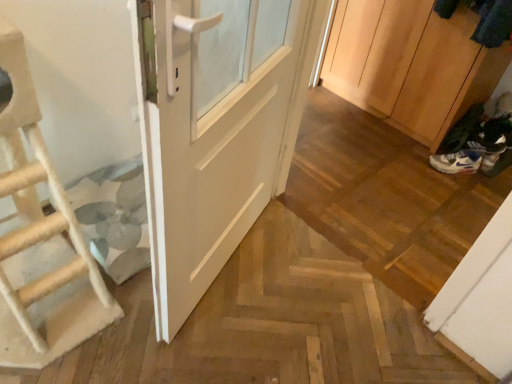
Where is `white leather shoe at lower right`? white leather shoe at lower right is located at coordinates (484, 154).

Find the location of `white mesh shoe at lower right`. white mesh shoe at lower right is located at coordinates (456, 162).

I want to click on white matte door at center, so click(215, 130).

This screenshot has height=384, width=512. What do you see at coordinates (215, 130) in the screenshot?
I see `white matte door at center` at bounding box center [215, 130].

Locate an element on the screen. This screenshot has width=512, height=384. white leather shoe at lower right is located at coordinates (484, 154).

In the scene shown: Could you tell me if white leather shoe at lower right is facing beige rope ladder at left?

No, white leather shoe at lower right is not facing towards beige rope ladder at left.

Is beige rope ladder at left a part of white leather shoe at lower right?

Actually, beige rope ladder at left is outside white leather shoe at lower right.

From a real-world perspective, is white leather shoe at lower right positioned above or below beige rope ladder at left?

From a real-world perspective, white leather shoe at lower right is physically below beige rope ladder at left.

Can you confirm if white leather shoe at lower right is wider than beige rope ladder at left?

In fact, white leather shoe at lower right might be narrower than beige rope ladder at left.

Is wooden cabinet at right at the back of white matte door at center?

No, white matte door at center is not facing the opposite direction of wooden cabinet at right.

From the image's perspective, relative to wooden cabinet at right, is white matte door at center above or below?

white matte door at center is below wooden cabinet at right.

Does white matte door at center touch wooden cabinet at right?

No, white matte door at center is not in contact with wooden cabinet at right.

From a real-world perspective, is white matte door at center positioned above or below wooden cabinet at right?

In terms of real-world spatial position, white matte door at center is above wooden cabinet at right.

Considering the relative sizes of white matte door at center and beige rope ladder at left in the image provided, is white matte door at center smaller than beige rope ladder at left?

Correct, white matte door at center occupies less space than beige rope ladder at left.

Is white matte door at center facing towards beige rope ladder at left?

No, white matte door at center is not facing towards beige rope ladder at left.

Consider the image. Considering the relative positions of white matte door at center and beige rope ladder at left in the image provided, is white matte door at center to the right of beige rope ladder at left from the viewer's perspective?

Correct, you'll find white matte door at center to the right of beige rope ladder at left.

Is wooden cabinet at right inside or outside of white leather shoe at lower right?

wooden cabinet at right is located beyond the bounds of white leather shoe at lower right.

From the image's perspective, does wooden cabinet at right appear lower than white leather shoe at lower right?

No, from the image's perspective, wooden cabinet at right is not beneath white leather shoe at lower right.

Relative to white leather shoe at lower right, is wooden cabinet at right in front or behind?

wooden cabinet at right is in front of white leather shoe at lower right.

In terms of width, does white mesh shoe at lower right look wider or thinner when compared to white leather shoe at lower right?

Considering their sizes, white mesh shoe at lower right looks slimmer than white leather shoe at lower right.

Is point (477, 169) more distant than point (498, 147)?

No, it is in front of (498, 147).

Can you tell me how much white mesh shoe at lower right and white leather shoe at lower right differ in facing direction?

The angle between the facing direction of white mesh shoe at lower right and the facing direction of white leather shoe at lower right is 11.1 degrees.

Would you say white mesh shoe at lower right is outside white leather shoe at lower right?

That's correct, white mesh shoe at lower right is outside of white leather shoe at lower right.

Considering the sizes of objects white mesh shoe at lower right and wooden cabinet at right in the image provided, who is smaller, white mesh shoe at lower right or wooden cabinet at right?

With smaller size is white mesh shoe at lower right.

Which object is further away from the camera, white mesh shoe at lower right or wooden cabinet at right?

white mesh shoe at lower right is further away from the camera.

Where is `cabinetry above the white mesh shoe at lower right (from the image's perspective)`? cabinetry above the white mesh shoe at lower right (from the image's perspective) is located at coordinates (410, 64).

From the image's perspective, which is above, white mesh shoe at lower right or wooden cabinet at right?

wooden cabinet at right is shown above in the image.

Is point (162, 222) less distant than point (488, 158)?

That is True.

Between white matte door at center and white leather shoe at lower right, which one has less height?

white leather shoe at lower right.

Would you consider white matte door at center to be distant from white leather shoe at lower right?

Indeed, white matte door at center is not near white leather shoe at lower right.

Locate an element on the screen. This screenshot has height=384, width=512. shoe below the beige rope ladder at left (from a real-world perspective) is located at coordinates (484, 154).

At what (x,y) coordinates should I click in order to perform the action: click on door lying on the left of wooden cabinet at right. Please return your answer as a coordinate pair (x, y). The height and width of the screenshot is (384, 512). Looking at the image, I should click on (215, 130).

From the picture: Based on their spatial positions, is white matte door at center or white leather shoe at lower right closer to beige rope ladder at left?

white matte door at center.

Considering their positions, is white mesh shoe at lower right positioned further to beige rope ladder at left than white matte door at center?

white mesh shoe at lower right is positioned further to the anchor beige rope ladder at left.

Considering their positions, is white matte door at center positioned further to white leather shoe at lower right than white mesh shoe at lower right?

Based on the image, white matte door at center appears to be further to white leather shoe at lower right.

Based on their spatial positions, is white matte door at center or wooden cabinet at right closer to white leather shoe at lower right?

Based on the image, wooden cabinet at right appears to be nearer to white leather shoe at lower right.

Looking at the image, which one is located further to beige rope ladder at left, white matte door at center or wooden cabinet at right?

Based on the image, wooden cabinet at right appears to be further to beige rope ladder at left.

Based on their spatial positions, is white matte door at center or white mesh shoe at lower right closer to beige rope ladder at left?

white matte door at center.

Considering their positions, is wooden cabinet at right positioned closer to white leather shoe at lower right than white matte door at center?

wooden cabinet at right lies closer to white leather shoe at lower right than the other object.

From the picture: From the image, which object appears to be nearer to white leather shoe at lower right, white mesh shoe at lower right or wooden cabinet at right?

white mesh shoe at lower right lies closer to white leather shoe at lower right than the other object.

Where is `cabinetry between beige rope ladder at left and white mesh shoe at lower right from left to right`? The width and height of the screenshot is (512, 384). cabinetry between beige rope ladder at left and white mesh shoe at lower right from left to right is located at coordinates (410, 64).

This screenshot has width=512, height=384. What are the coordinates of `shoe between wooden cabinet at right and white mesh shoe at lower right in the up-down direction` in the screenshot? It's located at (484, 154).

The image size is (512, 384). Identify the location of door located between beige rope ladder at left and white mesh shoe at lower right in the left-right direction. (215, 130).

Find the location of a particular element. The width and height of the screenshot is (512, 384). cabinetry between beige rope ladder at left and white leather shoe at lower right is located at coordinates (410, 64).